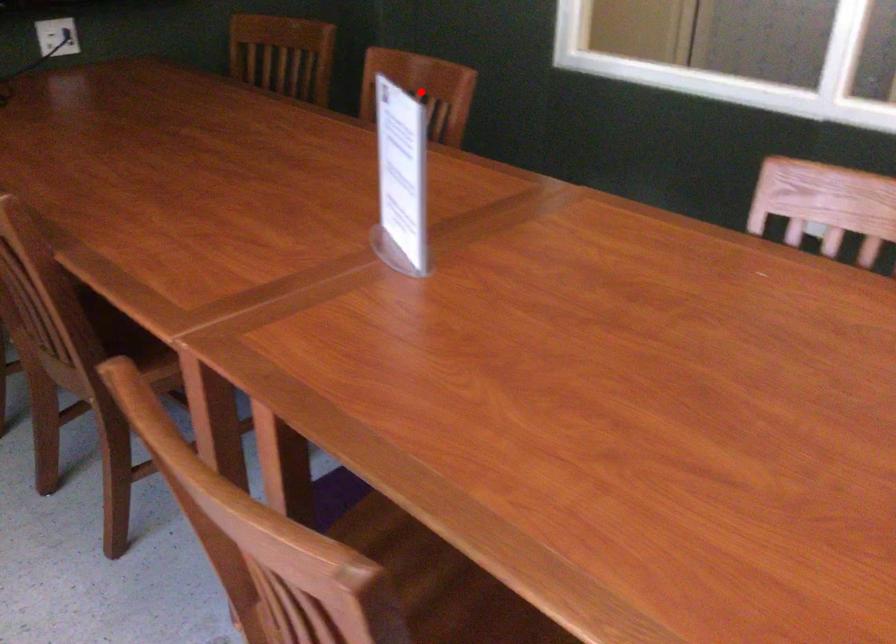
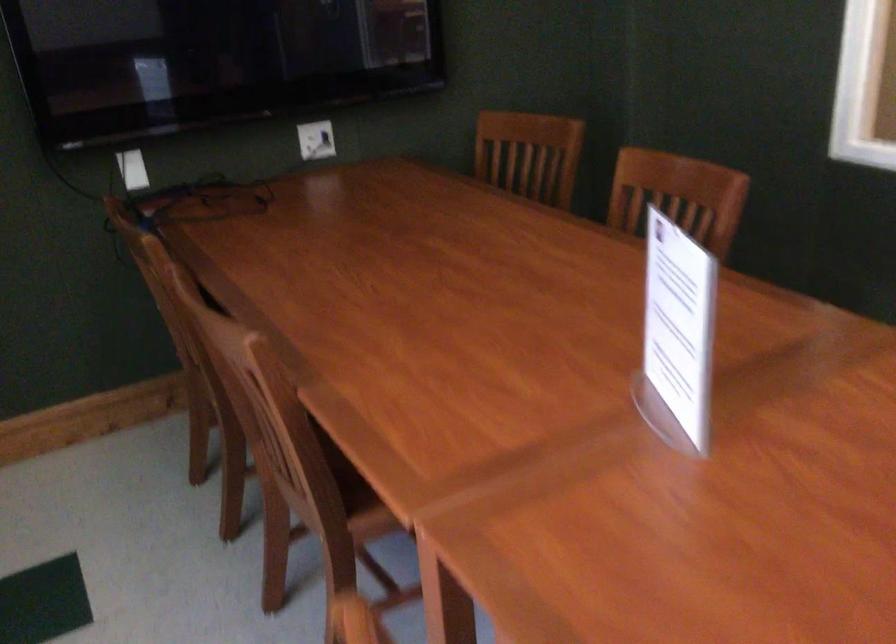
Locate, in the second image, the point that corresponds to the highlighted location in the first image.

(677, 196)